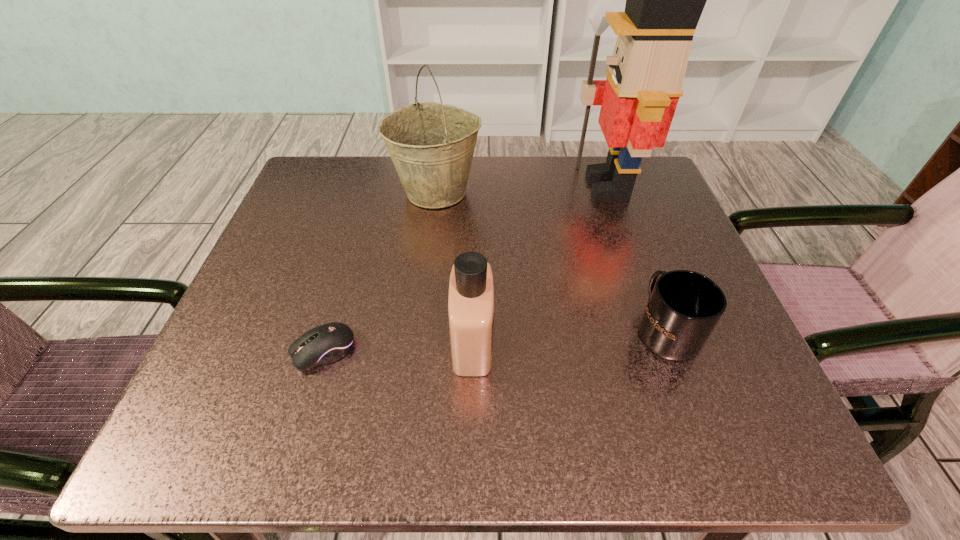
I want to click on the tallest object, so click(x=664, y=0).

The height and width of the screenshot is (540, 960). In order to click on wine bucket in this screenshot , I will do `click(431, 144)`.

Locate an element on the screen. perfume is located at coordinates tap(471, 292).

Where is `mug`? The width and height of the screenshot is (960, 540). mug is located at coordinates [x=683, y=308].

Identify the location of the shortest object. (327, 343).

You are a GUI agent. You are given a task and a screenshot of the screen. Output one action in this format:
    pyautogui.click(x=<x>, y=<y>)
    Task: Click on the free space located in front of the nutcracker holding the staff
    
    Given the screenshot: What is the action you would take?
    pyautogui.click(x=499, y=186)

Image resolution: width=960 pixels, height=540 pixels. In order to click on vacant area situated in front of the nutcracker holding the staff in this screenshot , I will do click(x=442, y=186).

Locate an element on the screen. This screenshot has width=960, height=540. blank space located in front of the nutcracker holding the staff is located at coordinates (428, 186).

In order to click on vacant space located 0.190m on the right of the wine bucket in this screenshot , I will do `click(567, 192)`.

At what (x,y) coordinates should I click in order to perform the action: click on vacant space positioned 0.360m on the front label of the perfume. Please return your answer as a coordinate pair (x, y). Looking at the image, I should click on (721, 342).